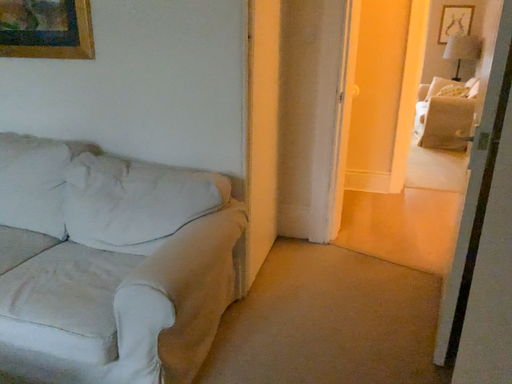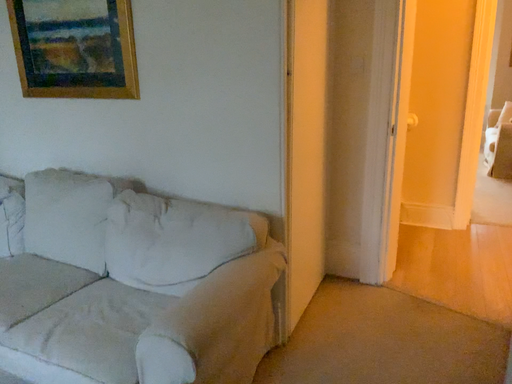
Question: Which way did the camera rotate in the video?

Choices:
 (A) rotated right
 (B) rotated left

Answer: (B)